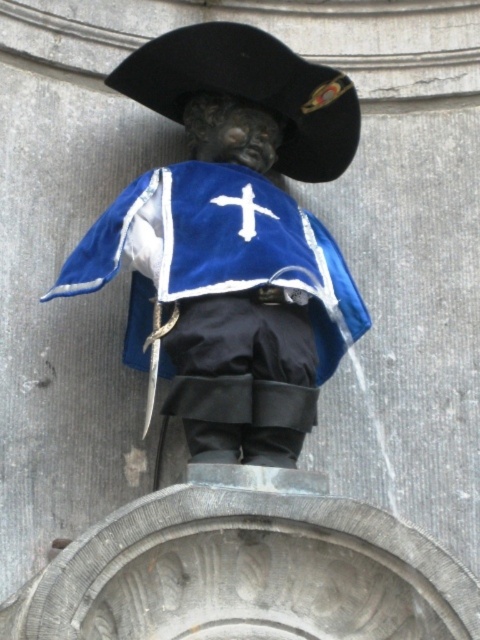
You are an artist preparing to sketch the statue. You need to decide which object to draw first based on their sizes. Which object is taller between the velvet blue cape at center and the black felt hat at upper center?

→ The velvet blue cape at center is taller than the black felt hat at upper center according to the description.